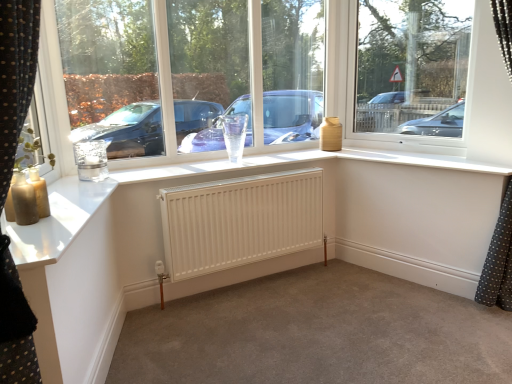
This screenshot has height=384, width=512. I want to click on empty space that is ontop of white matte radiator at center (from a real-world perspective), so click(240, 178).